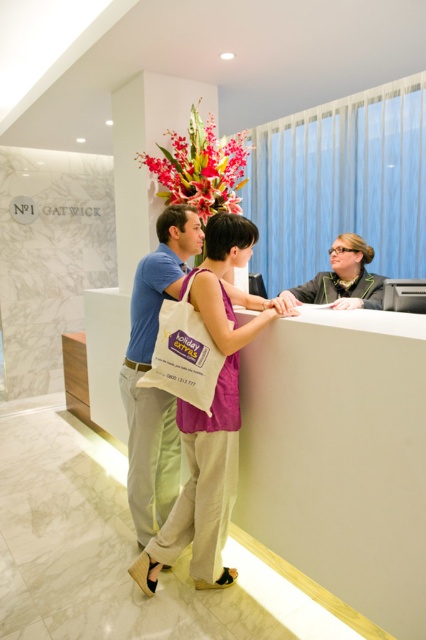
You are a guest at the hotel and need to place your white canvas tote at center on the counter. The counter has limited space. Can you place it to the right of the matte black blazer at center?

The white canvas tote at center is currently to the left of the matte black blazer at center. To place it to the right, you would need to move it from its current position to the right side of the blazer.

You are a hotel guest who just arrived and wants to place your belongings on the reception desk. You have a light blue cotton shirt at center and a white canvas tote at center. Can you put both items on the desk without them overlapping? Please explain.

The light blue cotton shirt at center is 13.48 inches away from the white canvas tote at center. Since the distance between them is more than the combined width of both items, you can place them on the desk without overlapping.